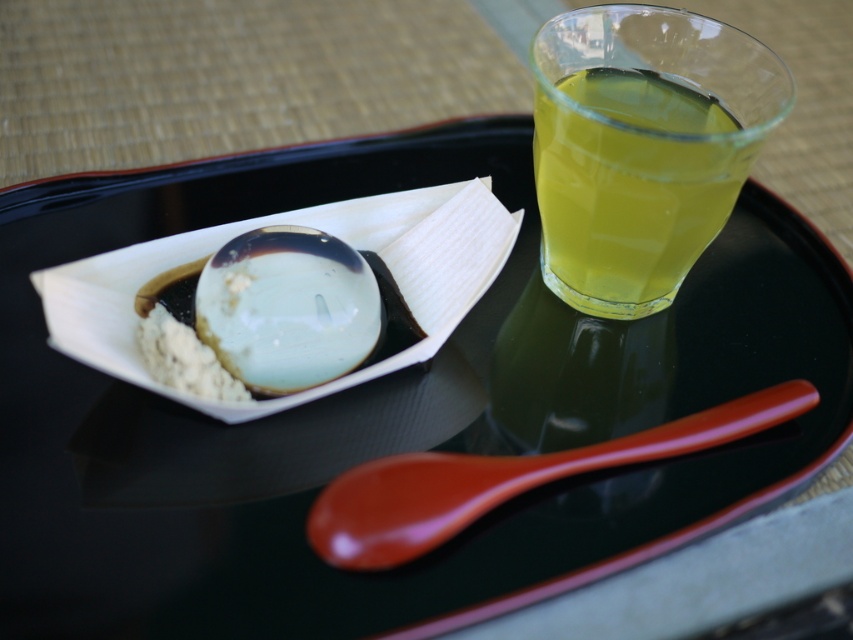
You are a person who wants to drink water from the translucent glass cup at upper right. However, you need to place the glossy plastic spoon at lower center into the cup. Can the spoon fit into the cup?

The translucent glass cup at upper right is much taller than the glossy plastic spoon at lower center, so the spoon can fit into the cup.

You are a person with a height of 5 feet 8 inches. You are standing in front of the black tray with a red rim and looking at the translucent glass ball at upper left. Can you reach it without moving your feet?

The translucent glass ball at upper left is 17.31 inches away from viewer. Since the average arm length of a person who is 5 feet 8 inches tall is about 27 inches, you can reach it without moving your feet.